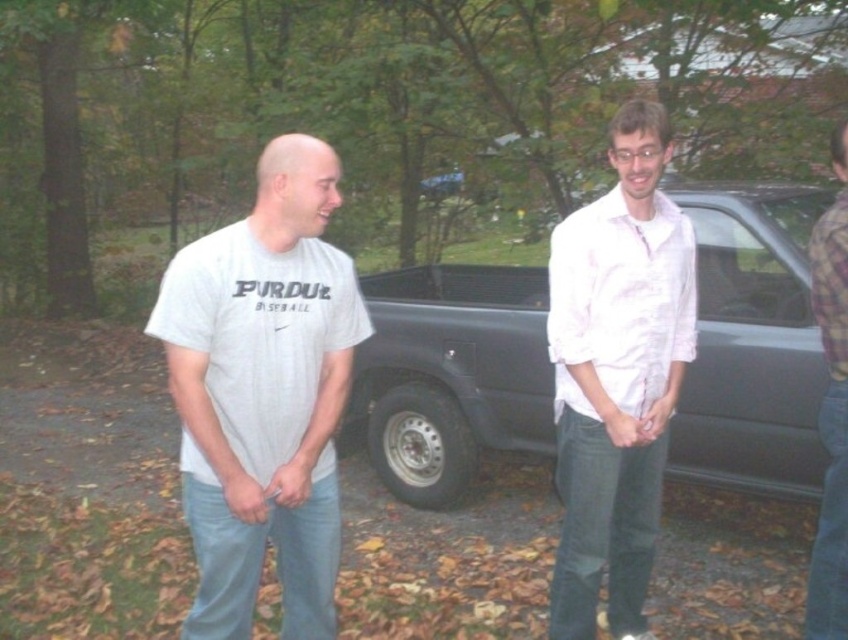
Is point (739, 433) farther from viewer compared to point (826, 636)?

Yes, point (739, 433) is behind point (826, 636).

Is metallic gray truck at center above plaid flannel shirt at right?

No.

Locate an element on the screen. The image size is (848, 640). metallic gray truck at center is located at coordinates (751, 340).

Locate an element on the screen. This screenshot has width=848, height=640. white cotton t-shirt at center is located at coordinates tap(263, 394).

Does white cotton t-shirt at center appear on the right side of plaid flannel shirt at right?

In fact, white cotton t-shirt at center is to the left of plaid flannel shirt at right.

The image size is (848, 640). I want to click on white cotton t-shirt at center, so click(x=263, y=394).

What do you see at coordinates (751, 340) in the screenshot? I see `metallic gray truck at center` at bounding box center [751, 340].

Does metallic gray truck at center appear on the left side of white cotton shirt at center?

Correct, you'll find metallic gray truck at center to the left of white cotton shirt at center.

Is point (523, 284) positioned after point (578, 506)?

Yes, point (523, 284) is farther from viewer.

Locate an element on the screen. This screenshot has height=640, width=848. metallic gray truck at center is located at coordinates (751, 340).